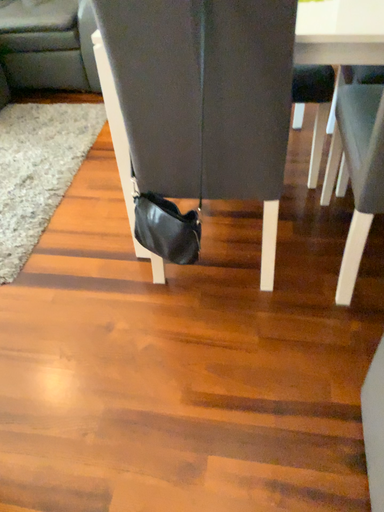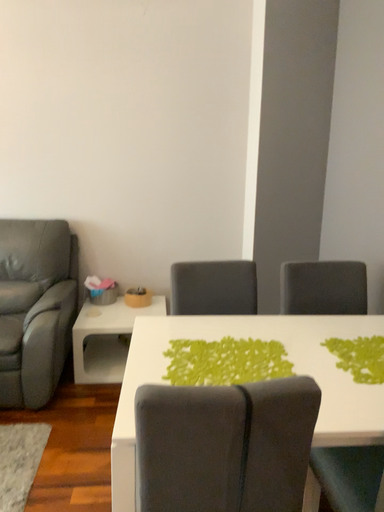
Question: How did the camera likely rotate when shooting the video?

Choices:
 (A) rotated right
 (B) rotated left

Answer: (A)